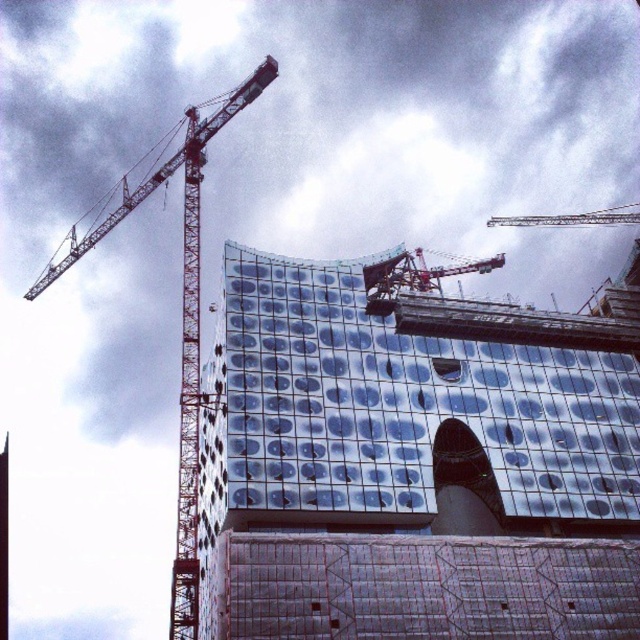
You are a construction worker looking at the site from the ground. Which crane is closer to you, the reddish metallic crane at left or the metallic silver crane at upper center?

The reddish metallic crane at left is closer to you because it is positioned to the left of the metallic silver crane at upper center, which is further away.

You are an architect standing at the construction site. You need to determine the spatial relationship between the metallic glass building at center and the reddish metallic crane at left. Which object is closer to you?

The metallic glass building at center is closer to you because it is in front of the reddish metallic crane at left.